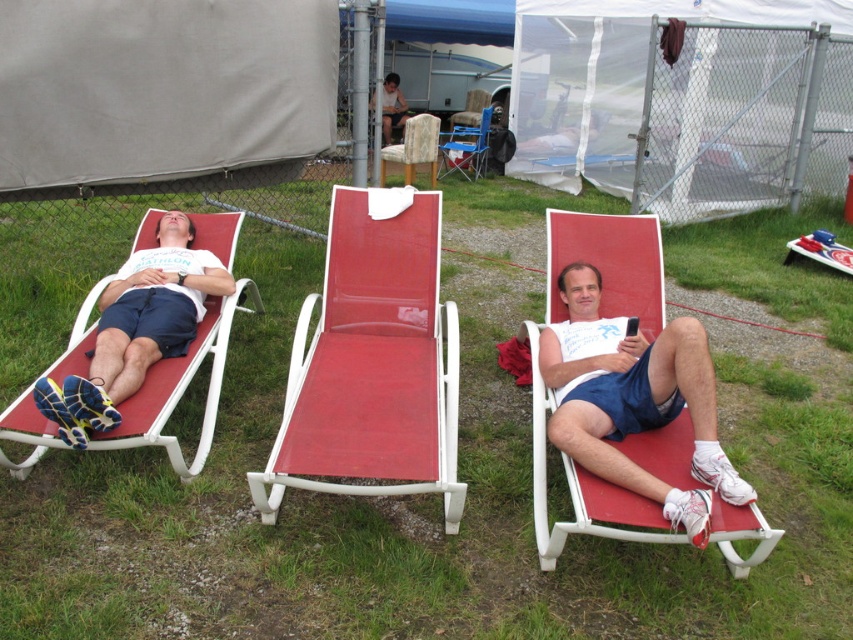
Is white matte shirt at center below matte red lounge chair at left?

Yes, white matte shirt at center is below matte red lounge chair at left.

Can you confirm if white matte shirt at center is wider than matte red lounge chair at left?

Incorrect, white matte shirt at center's width does not surpass matte red lounge chair at left's.

Who is more forward, (631,483) or (160,241)?

Positioned in front is point (631,483).

Locate an element on the screen. white matte shirt at center is located at coordinates (634, 401).

In the scene shown: Does green grass at center have a greater height compared to white matte shirt at center?

In fact, green grass at center may be shorter than white matte shirt at center.

At what (x,y) coordinates should I click in order to perform the action: click on green grass at center. Please return your answer as a coordinate pair (x, y). This screenshot has height=640, width=853. Looking at the image, I should click on (461, 480).

Who is shorter, white matte shirt at center or wooden textured chair at center?

wooden textured chair at center

You are a GUI agent. You are given a task and a screenshot of the screen. Output one action in this format:
    pyautogui.click(x=<x>, y=<y>)
    Task: Click on the white matte shirt at center
    The height and width of the screenshot is (640, 853).
    Given the screenshot: What is the action you would take?
    pyautogui.click(x=634, y=401)